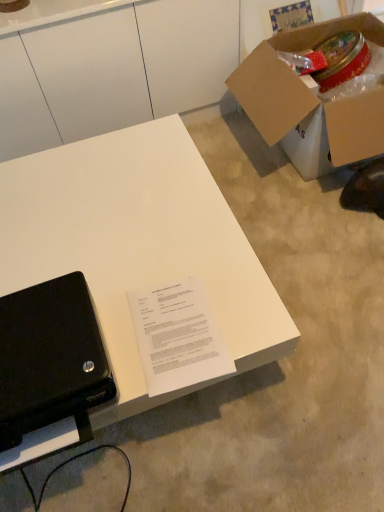
This screenshot has width=384, height=512. I want to click on empty space that is ontop of white matte desk at lower left (from a real-world perspective), so click(x=104, y=219).